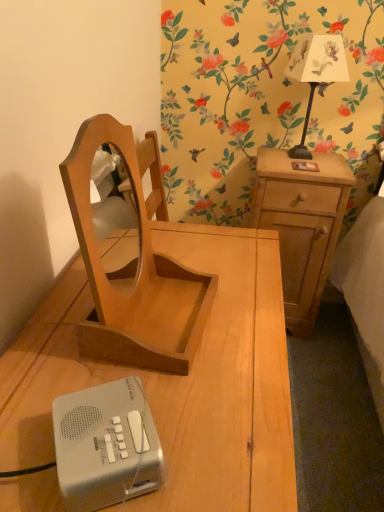
Question: Choose the correct answer: Is silver plastic radio at lower left inside light brown wood at right, the second nightstand positioned from the front, or outside it?

Choices:
 (A) outside
 (B) inside

Answer: (A)

Question: Considering their positions, is silver plastic radio at lower left located in front of or behind light brown wood at right, the second nightstand positioned from the front?

Choices:
 (A) behind
 (B) front

Answer: (B)

Question: Which object is positioned farthest from the wooden nightstand at center, placed as the second nightstand when sorted from right to left?

Choices:
 (A) light brown wood mirror at center
 (B) light brown wood at right, the first nightstand viewed from the back
 (C) white paper lampshade at upper right
 (D) silver plastic radio at lower left

Answer: (C)

Question: Considering the real-world distances, which object is closest to the white paper lampshade at upper right?

Choices:
 (A) wooden nightstand at center, the first nightstand viewed from the left
 (B) silver plastic radio at lower left
 (C) light brown wood at right, which is the 2th nightstand from left to right
 (D) light brown wood mirror at center

Answer: (C)